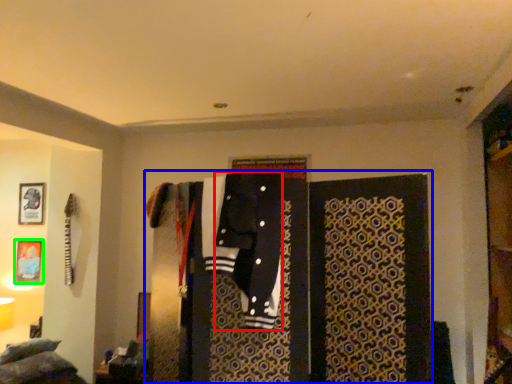
Question: Which object is the closest to the clothing (highlighted by a red box)? Choose among these: closet (highlighted by a blue box) or picture frame (highlighted by a green box).

Choices:
 (A) closet
 (B) picture frame

Answer: (A)